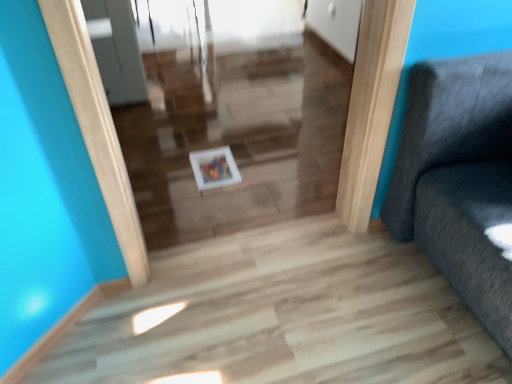
Question: Is white glossy picture frame at center spatially inside white glossy tray at center, or outside of it?

Choices:
 (A) inside
 (B) outside

Answer: (B)

Question: Based on their positions, is white glossy picture frame at center located to the left or right of white glossy tray at center?

Choices:
 (A) left
 (B) right

Answer: (A)

Question: Is white glossy picture frame at center taller or shorter than white glossy tray at center?

Choices:
 (A) short
 (B) tall

Answer: (A)

Question: From the image's perspective, is white glossy tray at center located above or below white glossy picture frame at center?

Choices:
 (A) above
 (B) below

Answer: (A)

Question: Based on their sizes in the image, would you say white glossy tray at center is bigger or smaller than white glossy picture frame at center?

Choices:
 (A) small
 (B) big

Answer: (B)

Question: Looking at their shapes, would you say white glossy tray at center is wider or thinner than white glossy picture frame at center?

Choices:
 (A) thin
 (B) wide

Answer: (A)

Question: Do you think white glossy tray at center is within white glossy picture frame at center, or outside of it?

Choices:
 (A) inside
 (B) outside

Answer: (B)